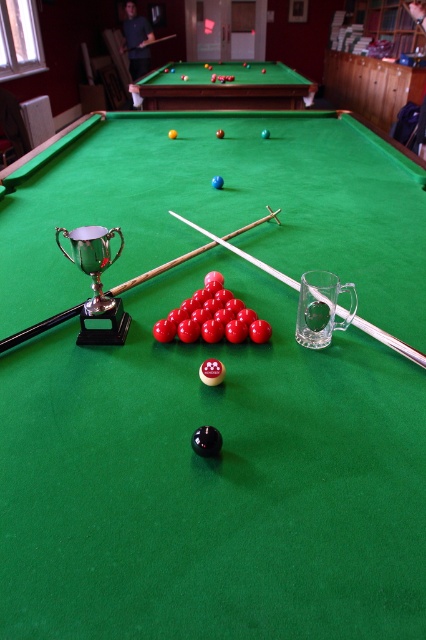
In the scene shown: You are setting up a new game and need to place a 1.5 meter wide tablecloth on the green felt pool table at upper center and the green felt billiard table at center. Which table requires a wider tablecloth?

The green felt pool table at upper center requires a wider tablecloth because it might be wider than the green felt billiard table at center according to the description.

You are a snooker player standing at the side of the table and you need to retrieve your cue. Which cue is closer to you, the white wood cue at center or the clear wood cue at center?

The white wood cue at center is located below the clear wood cue at center, so the white wood cue at center is closer to you.